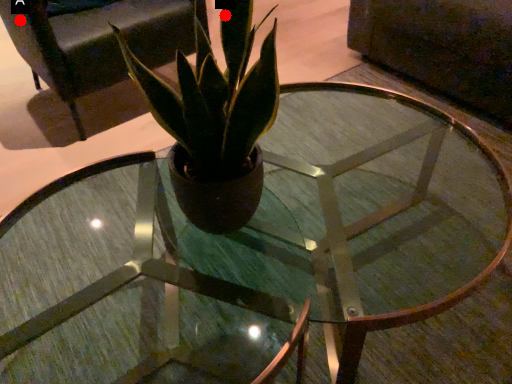
Question: Two points are circled on the image, labeled by A and B beside each circle. Which point appears farthest from the camera in this image?

Choices:
 (A) A is further
 (B) B is further

Answer: (A)